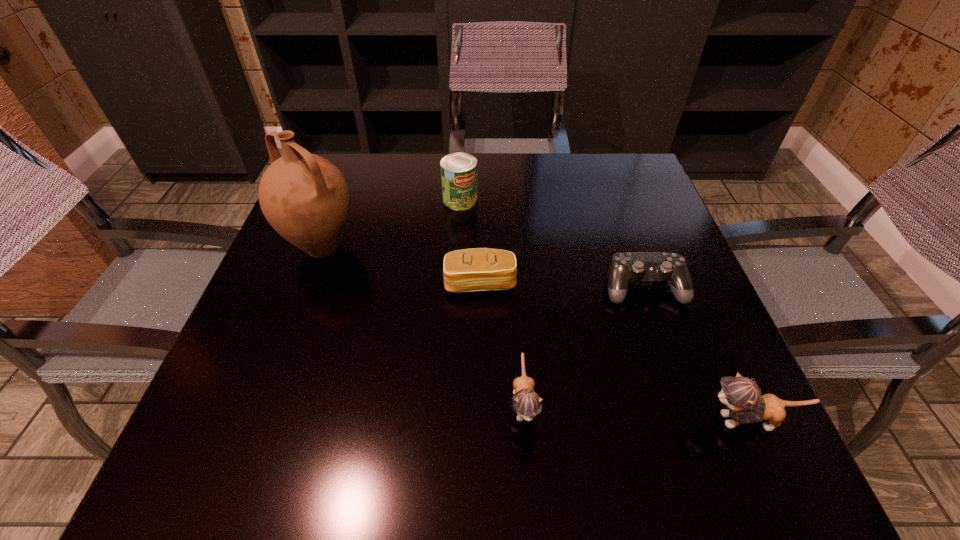
The width and height of the screenshot is (960, 540). What are the coordinates of `free spot between the taller kitten and the control` in the screenshot? It's located at (696, 354).

Locate an element on the screen. free point between the right kitten and the control is located at coordinates click(696, 354).

What are the coordinates of `free point between the clutch bag and the leftmost object` in the screenshot? It's located at (401, 266).

The width and height of the screenshot is (960, 540). I want to click on vacant area that lies between the can and the third shortest object, so click(x=492, y=301).

At what (x,y) coordinates should I click in order to perform the action: click on vacant area between the right kitten and the clutch bag. Please return your answer as a coordinate pair (x, y). Image resolution: width=960 pixels, height=540 pixels. Looking at the image, I should click on (614, 352).

Locate which object is the third closest to the shorter kitten. Please provide its 2D coordinates. Your answer should be formatted as a tuple, i.e. [(x, y)], where the tuple contains the x and y coordinates of a point satisfying the conditions above.

[(746, 405)]

At what (x,y) coordinates should I click in order to perform the action: click on object that stands as the closest to the shorter kitten. Please return your answer as a coordinate pair (x, y). Looking at the image, I should click on (480, 269).

Identify the location of vacant space that satisfies the following two spatial constraints: 1. on the zipper side of the clutch bag; 2. on the left side of the control. (480, 288).